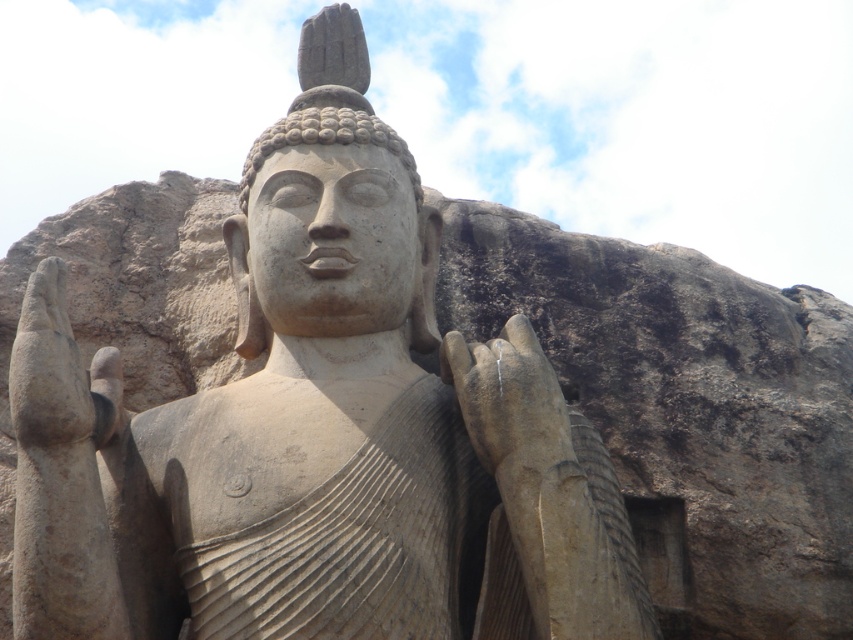
Question: Which object is closer to the camera taking this photo?

Choices:
 (A) matte stone hand at left
 (B) smooth stone hand at center

Answer: (B)

Question: Considering the relative positions of smooth stone hand at center and matte stone hand at left in the image provided, where is smooth stone hand at center located with respect to matte stone hand at left?

Choices:
 (A) left
 (B) right

Answer: (B)

Question: Does smooth stone hand at center have a larger size compared to matte stone hand at left?

Choices:
 (A) yes
 (B) no

Answer: (B)

Question: Among these points, which one is nearest to the camera?

Choices:
 (A) tap(537, 435)
 (B) tap(15, 378)

Answer: (A)

Question: Which object appears farthest from the camera in this image?

Choices:
 (A) smooth stone hand at center
 (B) matte stone hand at left

Answer: (B)

Question: Does smooth stone hand at center appear on the left side of matte stone hand at left?

Choices:
 (A) yes
 (B) no

Answer: (B)